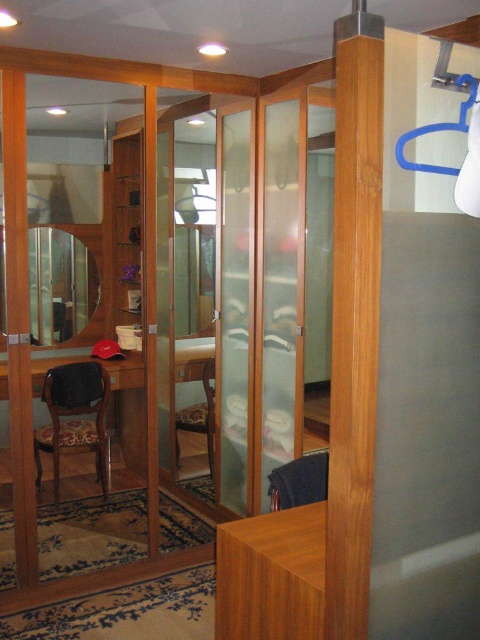
Question: Based on their relative distances, which object is farther from the wooden chair at center?

Choices:
 (A) clear plastic screen door at upper right
 (B) matte wooden mirror at center
 (C) wooden textured chair at left

Answer: (A)

Question: Does clear plastic screen door at upper right have a larger size compared to wooden textured chair at left?

Choices:
 (A) no
 (B) yes

Answer: (A)

Question: Can you confirm if clear plastic screen door at upper right is bigger than matte wooden mirror at center?

Choices:
 (A) yes
 (B) no

Answer: (A)

Question: Is matte wooden mirror at center to the left of wooden chair at center from the viewer's perspective?

Choices:
 (A) no
 (B) yes

Answer: (B)

Question: Considering the real-world distances, which object is farthest from the wooden textured chair at left?

Choices:
 (A) clear plastic screen door at upper right
 (B) wooden chair at center

Answer: (A)

Question: Which of the following is the closest to the observer?

Choices:
 (A) wooden chair at center
 (B) matte wooden mirror at center
 (C) wooden textured chair at left
 (D) clear plastic screen door at upper right

Answer: (D)